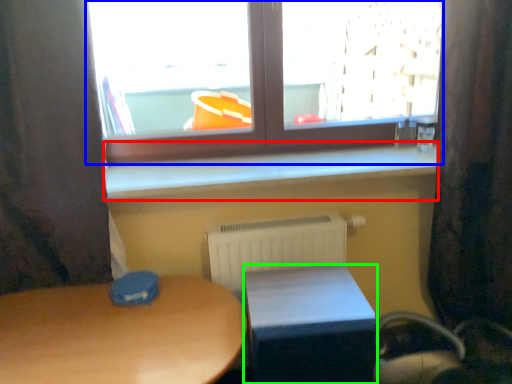
Question: Considering the real-world distances, which object is farthest from window sill (highlighted by a red box)? window (highlighted by a blue box) or table (highlighted by a green box)?

Choices:
 (A) window
 (B) table

Answer: (B)